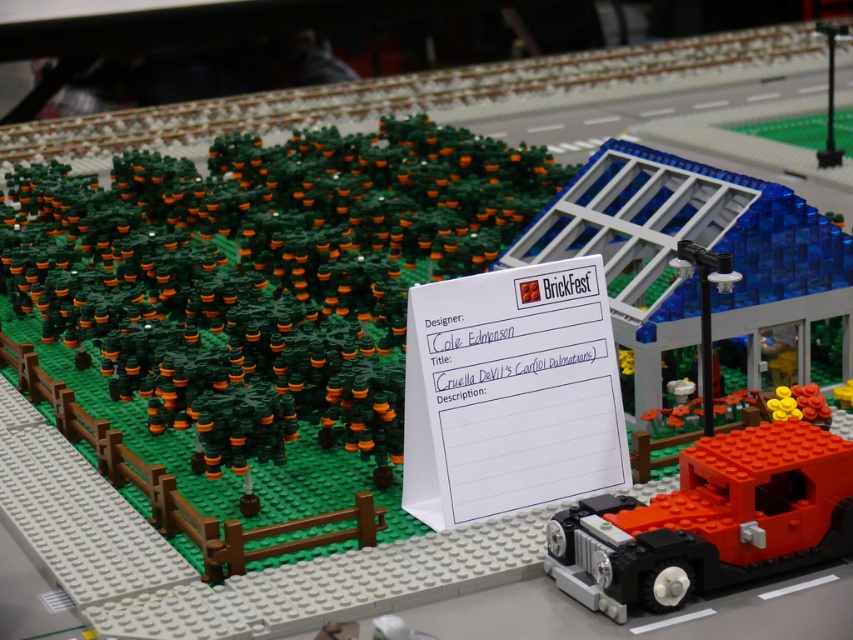
You are a LEGO enthusiast attending BrickFest and want to know if the green matte trees at upper left can fit in a space that is the same size as the brick red car at lower right. Can they fit?

The green matte trees at upper left might be wider than the brick red car at lower right, so they might not fit in the same space.

You are a LEGO enthusiast attending BrickFest and want to take a photo of the brick red car at lower right. To ensure the car is the main focus, you need to position yourself so that the green matte trees at upper left do not block the view. Based on their heights, can you stand at a lower elevation to achieve this?

The green matte trees at upper left are taller than the brick red car at lower right. To avoid the trees blocking the view of the car, you should position yourself at a lower elevation so that the shorter car is visible below the taller trees.